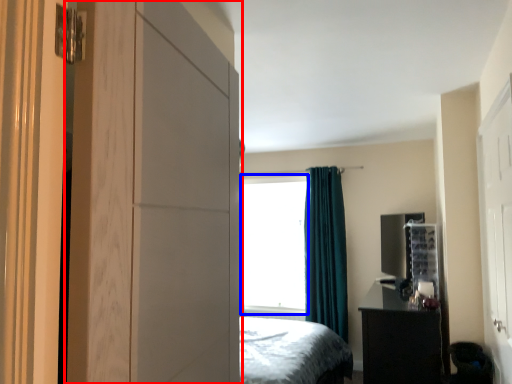
Question: Which object is closer to the camera taking this photo, dresser (highlighted by a red box) or window screen (highlighted by a blue box)?

Choices:
 (A) dresser
 (B) window screen

Answer: (A)